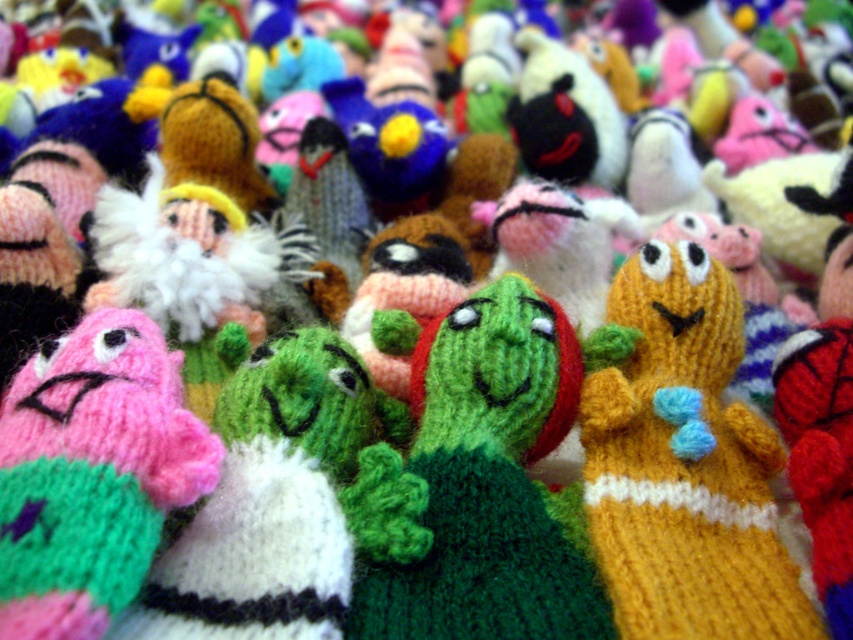
Question: Where is green knitted toy at center located in relation to yellow knitted toy at center-right in the image?

Choices:
 (A) above
 (B) below

Answer: (A)

Question: Which object is the closest to the pink knitted toy at left?

Choices:
 (A) yellow knitted toy at center-right
 (B) green knitted toy at center

Answer: (B)

Question: Which point is closer to the camera?

Choices:
 (A) (537, 310)
 (B) (680, 346)
 (C) (1, 445)

Answer: (C)

Question: Is green knitted toy at center to the left of pink knitted toy at left from the viewer's perspective?

Choices:
 (A) no
 (B) yes

Answer: (A)

Question: Which of the following is the farthest from the observer?

Choices:
 (A) yellow knitted toy at center-right
 (B) green knitted toy at center
 (C) pink knitted toy at left

Answer: (B)

Question: Considering the relative positions of green knitted toy at center and yellow knitted toy at center-right in the image provided, where is green knitted toy at center located with respect to yellow knitted toy at center-right?

Choices:
 (A) left
 (B) right

Answer: (A)